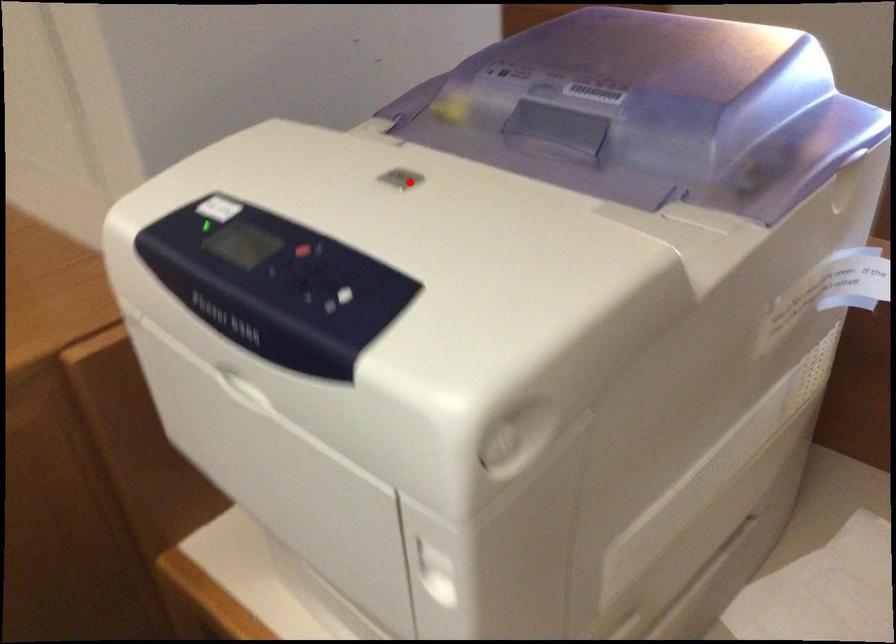
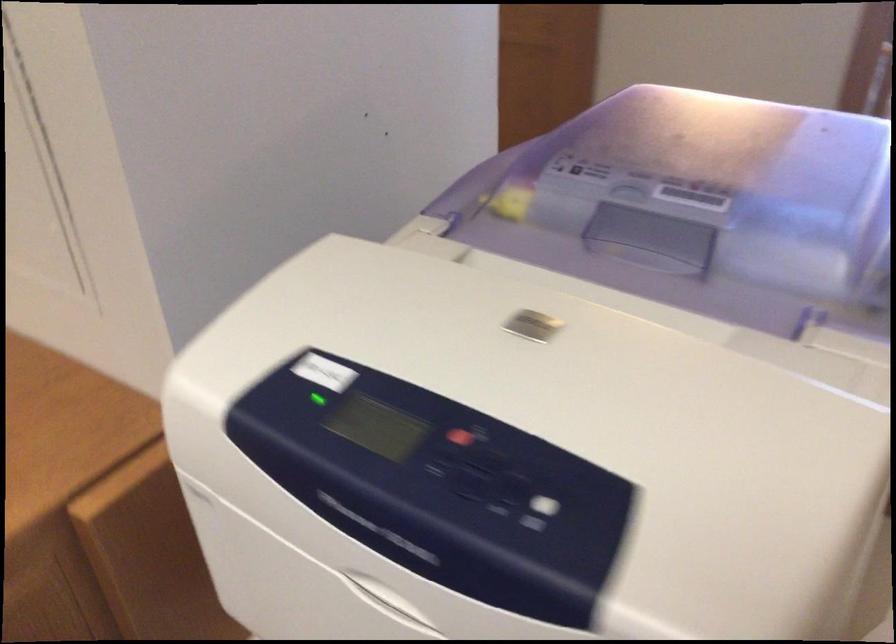
Question: A red point is marked in image1. In image2, is the corresponding 3D point closer to the camera or farther? Reply with the corresponding letter.

Choices:
 (A) The corresponding 3D point is closer.
 (B) The corresponding 3D point is farther.

Answer: (A)